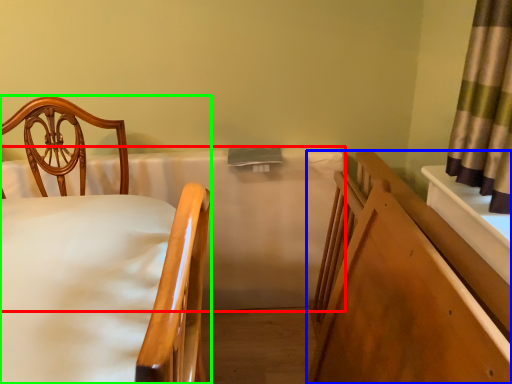
Question: Which is farther away from mattress (highlighted by a red box)? bed frame (highlighted by a blue box) or chair (highlighted by a green box)?

Choices:
 (A) bed frame
 (B) chair

Answer: (A)